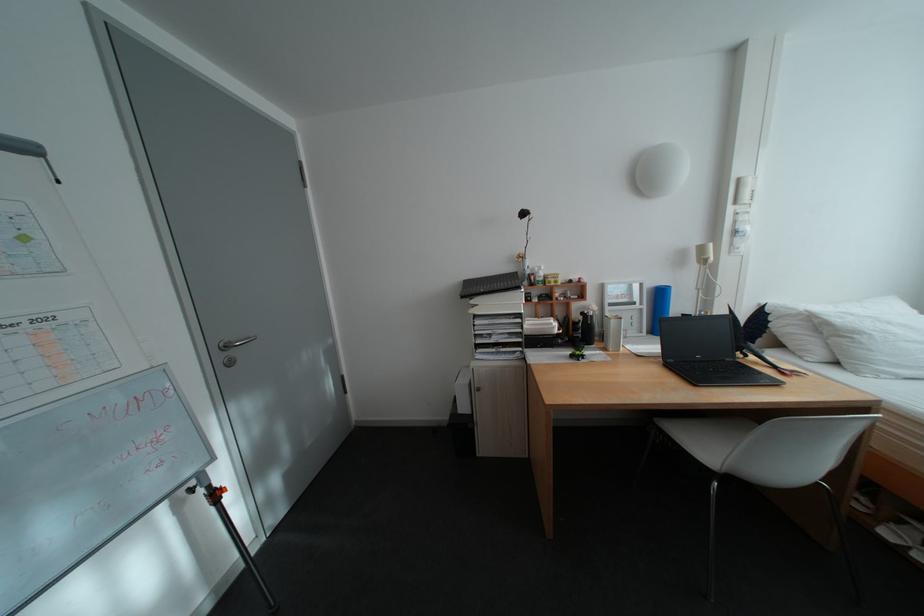
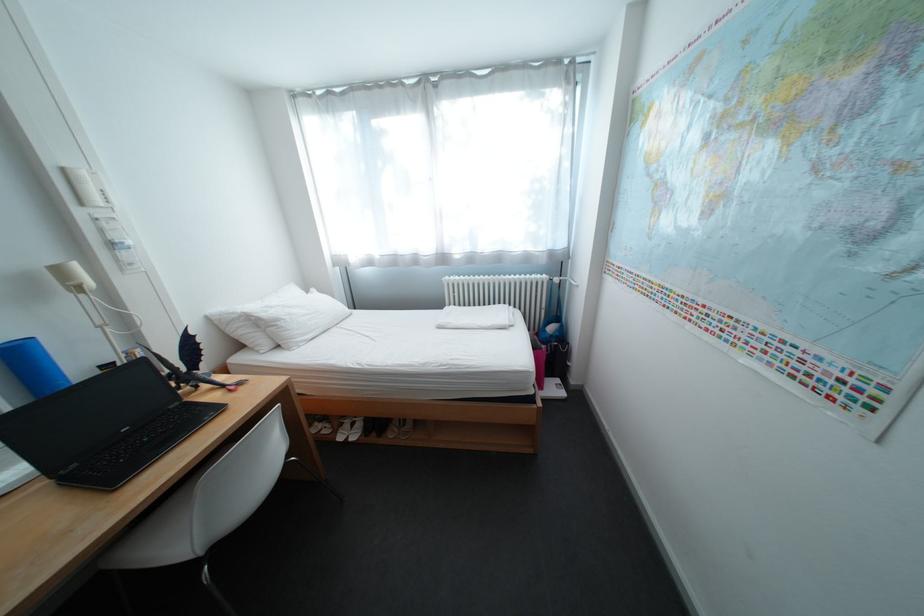
Locate, in the second image, the point that corresponds to pixel 751 180 in the first image.

(76, 171)